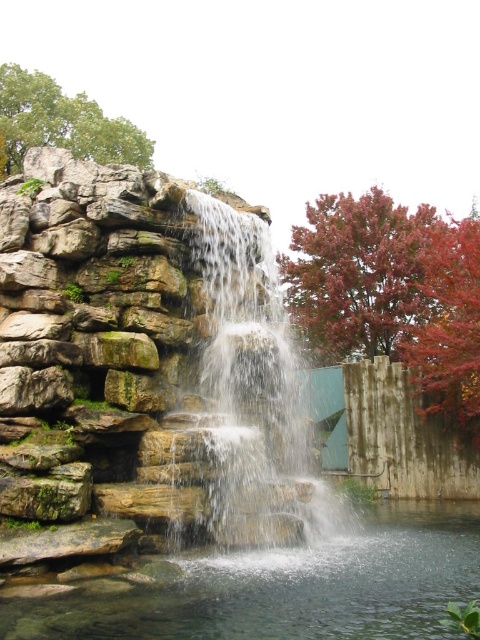
Question: Which point is closer to the camera?

Choices:
 (A) (471, 228)
 (B) (386, 209)
 (C) (0, 112)

Answer: (A)

Question: Does reddish-brown textured tree at upper right have a lesser width compared to red matte tree at upper right?

Choices:
 (A) yes
 (B) no

Answer: (A)

Question: Which of the following is the closest to the observer?

Choices:
 (A) green leafy tree at upper left
 (B) red matte tree at upper right
 (C) rocky textured waterfall at center
 (D) reddish-brown textured tree at upper right

Answer: (C)

Question: Estimate the real-world distances between objects in this image. Which object is closer to the rocky textured waterfall at center?

Choices:
 (A) green leafy tree at upper left
 (B) reddish-brown textured tree at upper right

Answer: (B)

Question: Is rocky textured waterfall at center smaller than red matte tree at upper right?

Choices:
 (A) no
 (B) yes

Answer: (B)

Question: Can you confirm if clear water at center is positioned below red matte tree at upper right?

Choices:
 (A) yes
 (B) no

Answer: (A)